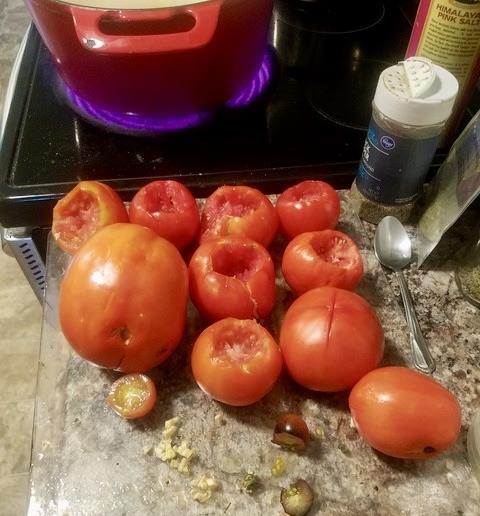
I want to click on bottle, so [x=402, y=139], [x=431, y=39].